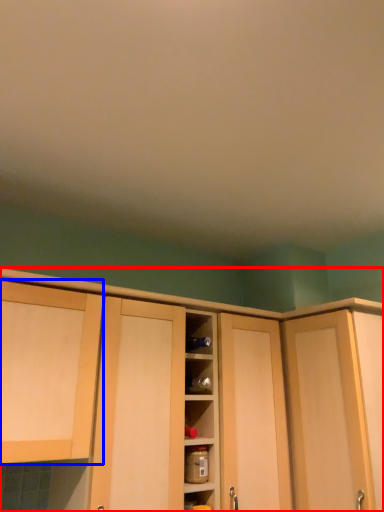
Question: Among these objects, which one is nearest to the camera, cabinetry (highlighted by a red box) or cabinetry (highlighted by a blue box)?

Choices:
 (A) cabinetry
 (B) cabinetry

Answer: (B)